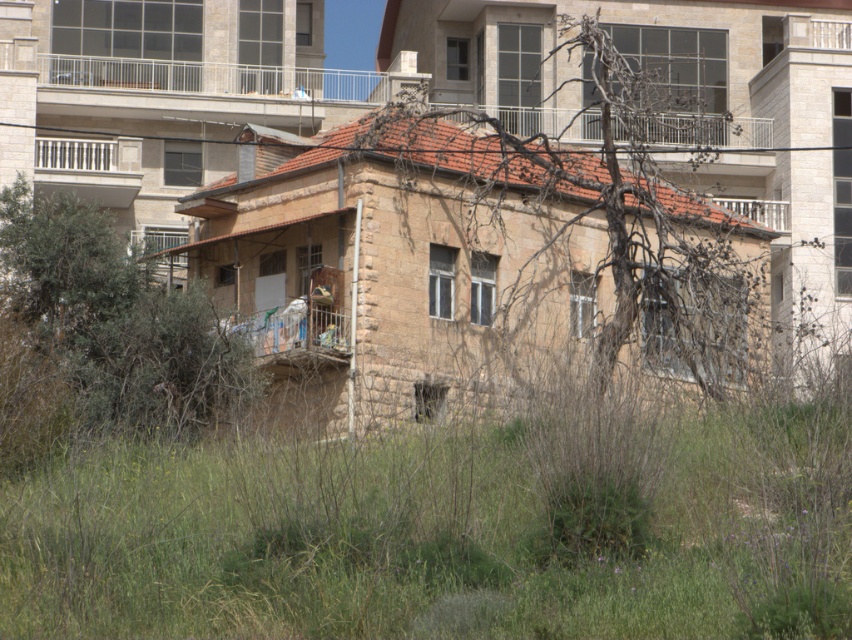
Question: Does white metal railing at upper center appear over white stone balcony at upper left?

Choices:
 (A) no
 (B) yes

Answer: (B)

Question: Among these objects, which one is nearest to the camera?

Choices:
 (A) white metal railing at upper center
 (B) white metal balcony at upper right

Answer: (A)

Question: Which of the following is the farthest from the observer?

Choices:
 (A) white metal balcony at upper right
 (B) metallic silver balcony at upper center
 (C) white stone balcony at upper left

Answer: (A)

Question: Considering the real-world distances, which object is closest to the white metal balcony at upper right?

Choices:
 (A) white metal railing at upper center
 (B) metallic silver balcony at upper center

Answer: (B)

Question: Is white metal railing at upper center closer to the viewer compared to white metal balcony at upper right?

Choices:
 (A) yes
 (B) no

Answer: (A)

Question: Does white stone balcony at upper left have a greater width compared to white metal balcony at upper right?

Choices:
 (A) yes
 (B) no

Answer: (A)